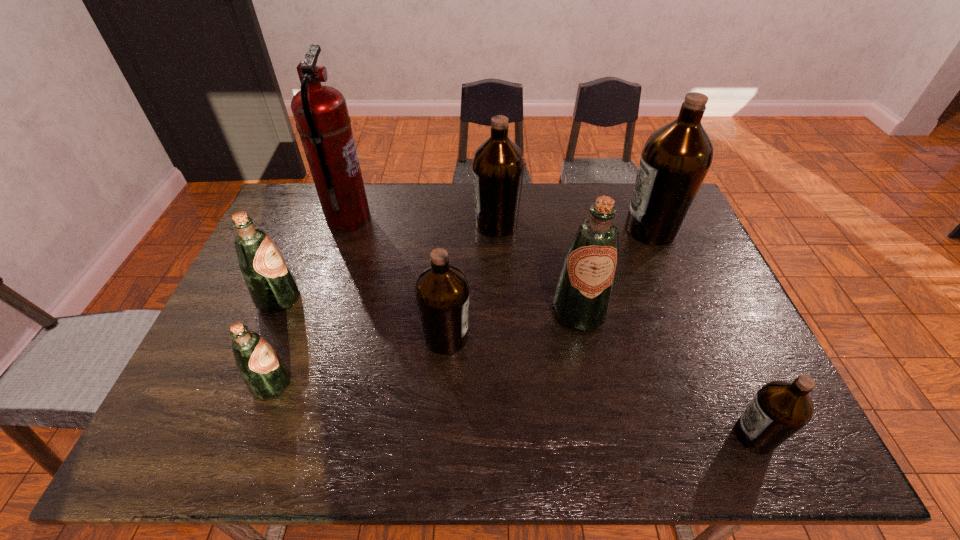
Locate an element on the screen. The width and height of the screenshot is (960, 540). the nearest brown olive oil is located at coordinates (780, 408).

Where is `the nearest olive oil`? The width and height of the screenshot is (960, 540). the nearest olive oil is located at coordinates (780, 408).

Find the location of `free space located on the nozzle side of the fire extinguisher`. free space located on the nozzle side of the fire extinguisher is located at coordinates (470, 219).

I want to click on free space located on the label of the biggest brown olive oil, so click(x=571, y=229).

Locate an element on the screen. This screenshot has height=540, width=960. free space located on the label of the biggest brown olive oil is located at coordinates (529, 229).

Where is `free space located 0.400m on the label of the biggest brown olive oil`? Image resolution: width=960 pixels, height=540 pixels. free space located 0.400m on the label of the biggest brown olive oil is located at coordinates [502, 229].

Image resolution: width=960 pixels, height=540 pixels. Identify the location of free space located on the label of the third smallest brown olive oil. (390, 224).

Find the location of `free space located on the label of the third smallest brown olive oil`. free space located on the label of the third smallest brown olive oil is located at coordinates (374, 224).

At what (x,y) coordinates should I click in order to perform the action: click on free space located on the label of the third smallest brown olive oil. Please return your answer as a coordinate pair (x, y). Looking at the image, I should click on (455, 224).

This screenshot has height=540, width=960. What are the coordinates of `vacant space located on the front-facing side of the rightmost green olive oil` in the screenshot? It's located at (592, 378).